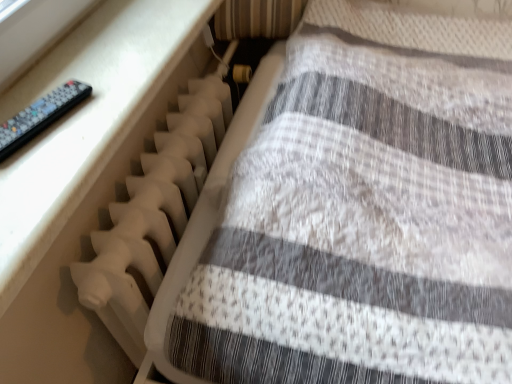
Question: In terms of width, does white plastic radiator at lower left look wider or thinner when compared to white plastic radiator at left?

Choices:
 (A) thin
 (B) wide

Answer: (B)

Question: From a real-world perspective, is white plastic radiator at lower left physically located above or below white plastic radiator at left?

Choices:
 (A) below
 (B) above

Answer: (B)

Question: Estimate the real-world distances between objects in this image. Which object is farther from the black plastic remote at left?

Choices:
 (A) white plastic radiator at lower left
 (B) white plastic radiator at left

Answer: (A)

Question: Based on their relative distances, which object is nearer to the white plastic radiator at lower left?

Choices:
 (A) black plastic remote at left
 (B) white plastic radiator at left

Answer: (B)